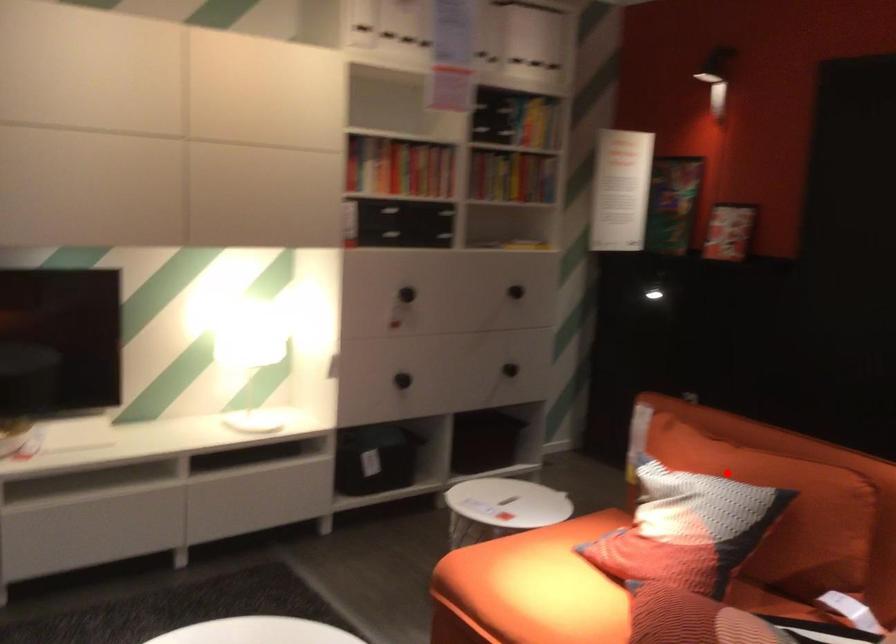
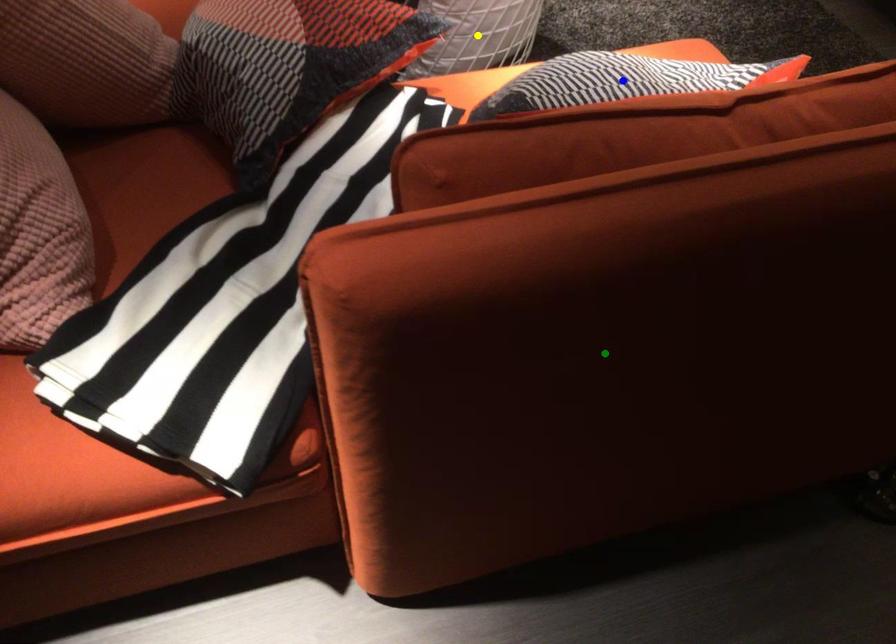
Question: I am providing you with two images of the same scene from different viewpoints. A red point is marked on the first image. You are given multiple points on the second image. Which point in image 2 represents the same 3d spot as the red point in image 1?

Choices:
 (A) yellow point
 (B) blue point
 (C) green point

Answer: (B)